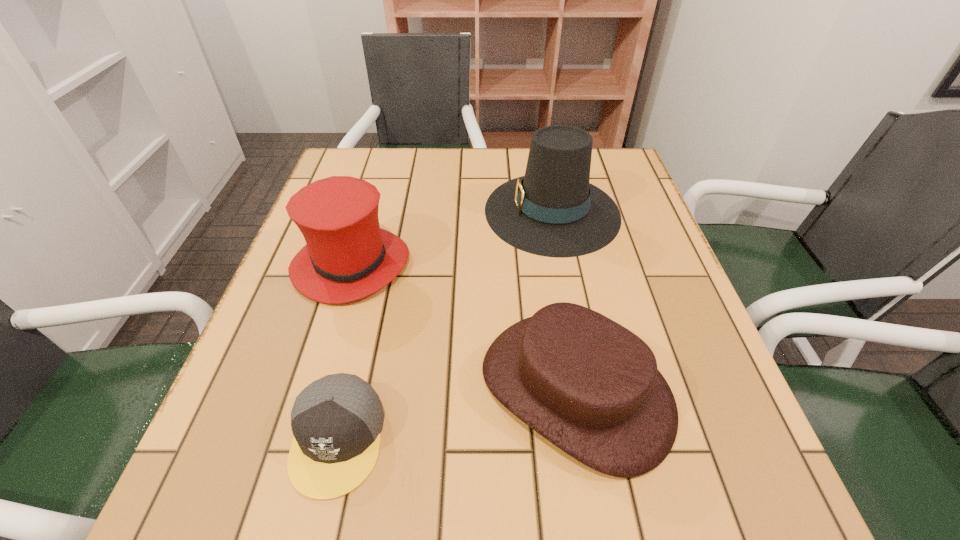
Where is `vacant area that satisfies the following two spatial constraints: 1. on the front-facing side of the tallest hat; 2. on the front-facing side of the cap`? vacant area that satisfies the following two spatial constraints: 1. on the front-facing side of the tallest hat; 2. on the front-facing side of the cap is located at coordinates (596, 439).

You are a GUI agent. You are given a task and a screenshot of the screen. Output one action in this format:
    pyautogui.click(x=<x>, y=<y>)
    Task: Click on the free location that satisfies the following two spatial constraints: 1. on the front-facing side of the tallest object; 2. on the front side of the second tallest hat
    The image size is (960, 540).
    Given the screenshot: What is the action you would take?
    pyautogui.click(x=563, y=264)

Where is `free location that satisfies the following two spatial constraints: 1. on the front-facing side of the tallest hat; 2. on the front-facing side of the shortest object`? This screenshot has height=540, width=960. free location that satisfies the following two spatial constraints: 1. on the front-facing side of the tallest hat; 2. on the front-facing side of the shortest object is located at coordinates (596, 439).

You are a GUI agent. You are given a task and a screenshot of the screen. Output one action in this format:
    pyautogui.click(x=<x>, y=<y>)
    Task: Click on the vacant space that satisfies the following two spatial constraints: 1. on the front-facing side of the tallest hat; 2. on the front side of the second shortest hat
    
    Given the screenshot: What is the action you would take?
    pyautogui.click(x=563, y=264)